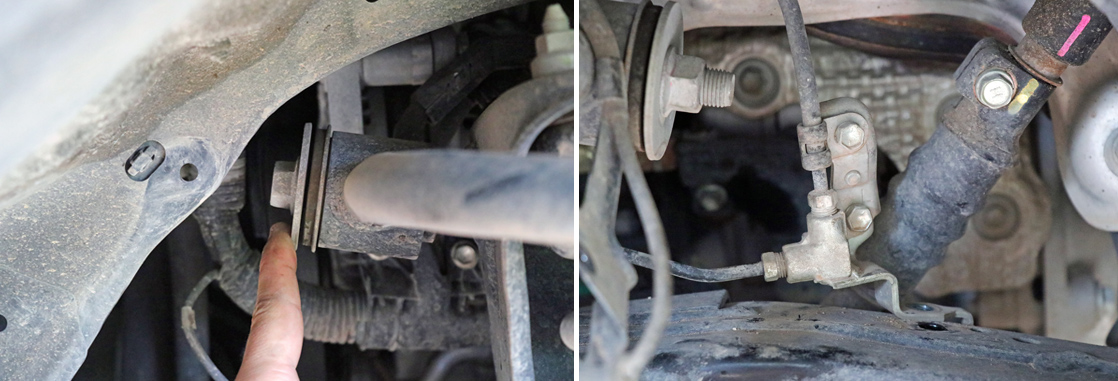
Identify the location of black cords. (699, 265), (796, 76).